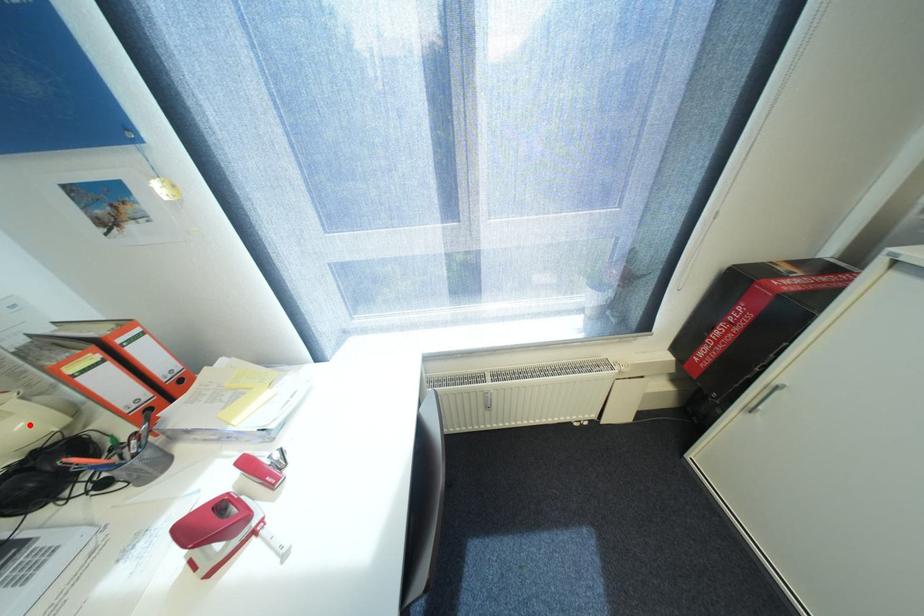
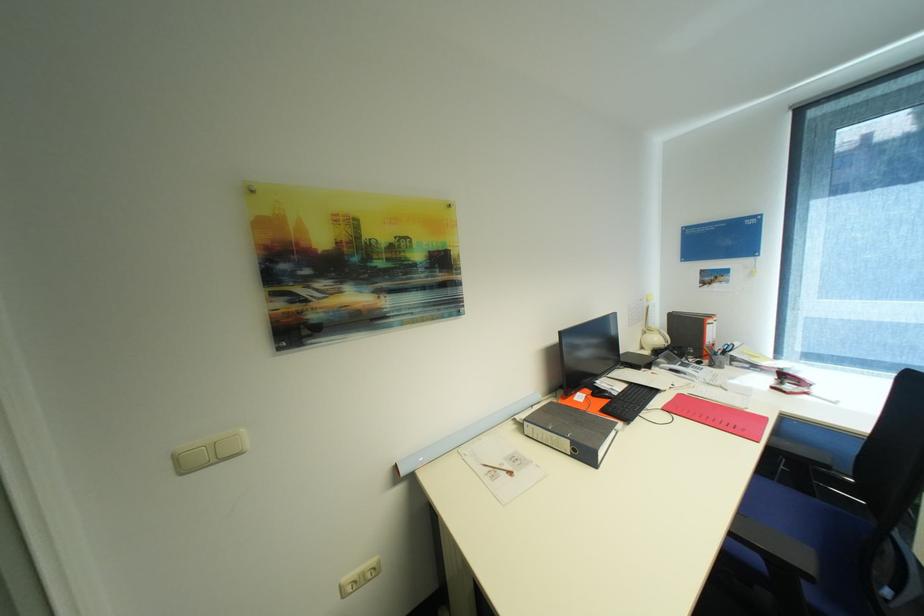
Question: I am providing you with two images of the same scene from different viewpoints. A red point is marked on the first image. Is the red point's position out of view in image 2?

Choices:
 (A) Yes
 (B) No

Answer: (B)